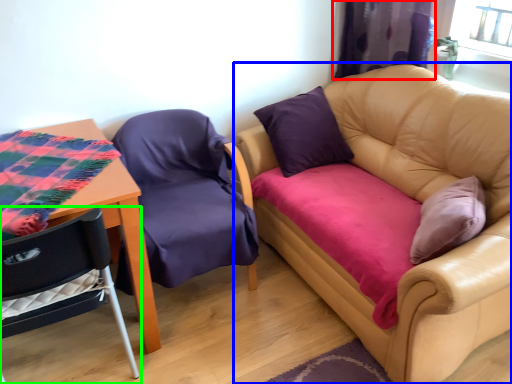
Question: Which object is positioned farthest from curtain (highlighted by a red box)? Select from studio couch (highlighted by a blue box) and chair (highlighted by a green box).

Choices:
 (A) studio couch
 (B) chair

Answer: (B)